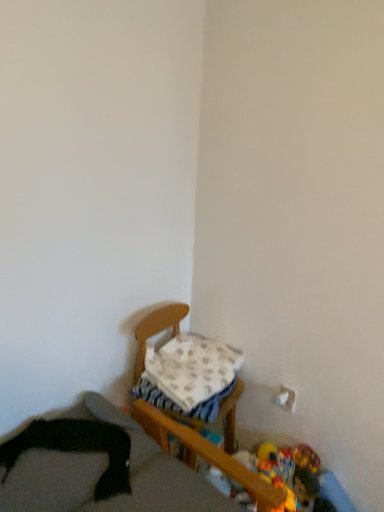
Question: Is plush yellow duck at lower right, which ranks as the first toy in left-to-right order, with plush multicolored toy at lower right, which is the 2th toy from left to right?

Choices:
 (A) yes
 (B) no

Answer: (B)

Question: Is plush yellow duck at lower right, which ranks as the first toy in left-to-right order, facing away from plush multicolored toy at lower right, which is the 2th toy from left to right?

Choices:
 (A) no
 (B) yes

Answer: (A)

Question: Could you tell me if plush yellow duck at lower right, which ranks as the first toy in left-to-right order, is turned towards plush multicolored toy at lower right, which is the 2th toy from left to right?

Choices:
 (A) no
 (B) yes

Answer: (A)

Question: Is plush yellow duck at lower right, which ranks as the first toy in left-to-right order, shorter than plush multicolored toy at lower right, positioned as the 2th toy in right-to-left order?

Choices:
 (A) no
 (B) yes

Answer: (B)

Question: Is plush yellow duck at lower right, the 3th toy in the right-to-left sequence, smaller than plush multicolored toy at lower right, which is the 2th toy from left to right?

Choices:
 (A) yes
 (B) no

Answer: (A)

Question: Is plush yellow duck at lower right, which ranks as the first toy in left-to-right order, to the left of plush multicolored toy at lower right, positioned as the 2th toy in right-to-left order, from the viewer's perspective?

Choices:
 (A) yes
 (B) no

Answer: (A)

Question: Is black fabric at lower left, acting as the 2th furniture starting from the back, positioned in front of plush multicolored toy at lower right, which is the 2th toy from left to right?

Choices:
 (A) no
 (B) yes

Answer: (B)

Question: Is plush multicolored toy at lower right, positioned as the 2th toy in right-to-left order, located within black fabric at lower left, acting as the 2th furniture starting from the back?

Choices:
 (A) no
 (B) yes

Answer: (A)

Question: Considering the relative positions of black fabric at lower left, positioned as the first furniture in front-to-back order, and plush multicolored toy at lower right, positioned as the 2th toy in right-to-left order, in the image provided, is black fabric at lower left, positioned as the first furniture in front-to-back order, to the left of plush multicolored toy at lower right, positioned as the 2th toy in right-to-left order, from the viewer's perspective?

Choices:
 (A) no
 (B) yes

Answer: (B)

Question: Is black fabric at lower left, acting as the 2th furniture starting from the back, aimed at plush multicolored toy at lower right, which is the 2th toy from left to right?

Choices:
 (A) yes
 (B) no

Answer: (B)

Question: Can you confirm if black fabric at lower left, positioned as the first furniture in front-to-back order, is wider than plush multicolored toy at lower right, positioned as the 2th toy in right-to-left order?

Choices:
 (A) no
 (B) yes

Answer: (B)

Question: From the image's perspective, is black fabric at lower left, positioned as the first furniture in front-to-back order, located beneath plush multicolored toy at lower right, which is the 2th toy from left to right?

Choices:
 (A) no
 (B) yes

Answer: (A)

Question: Would you say plush yellow duck at lower right, which ranks as the first toy in left-to-right order, is part of plush yellow duck at lower right, which is counted as the first toy, starting from the right,'s contents?

Choices:
 (A) no
 (B) yes

Answer: (A)